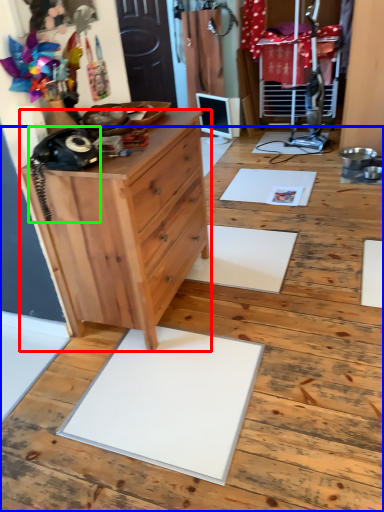
Question: Which is nearer to the chest of drawers (highlighted by a red box)? hardwood (highlighted by a blue box) or equipment (highlighted by a green box).

Choices:
 (A) hardwood
 (B) equipment

Answer: (B)